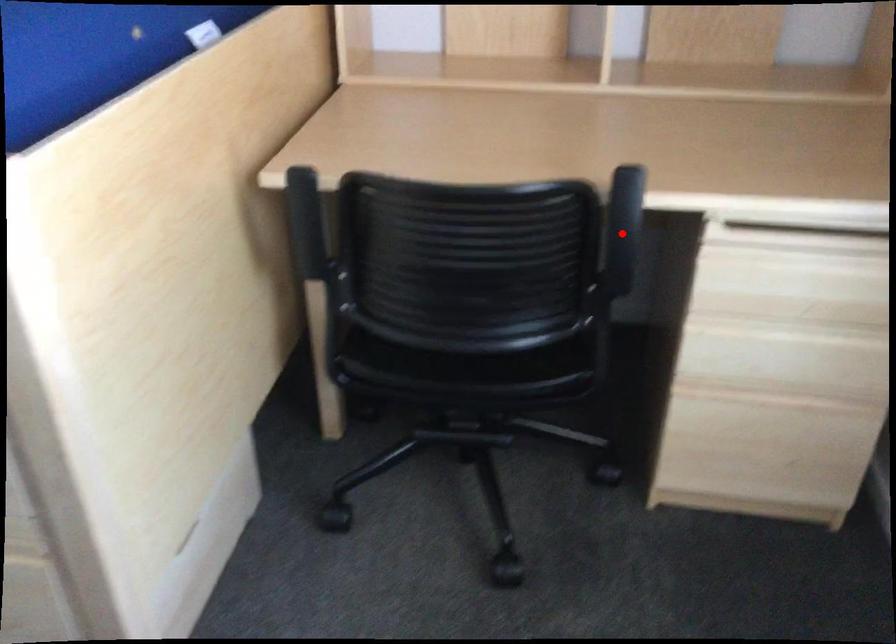
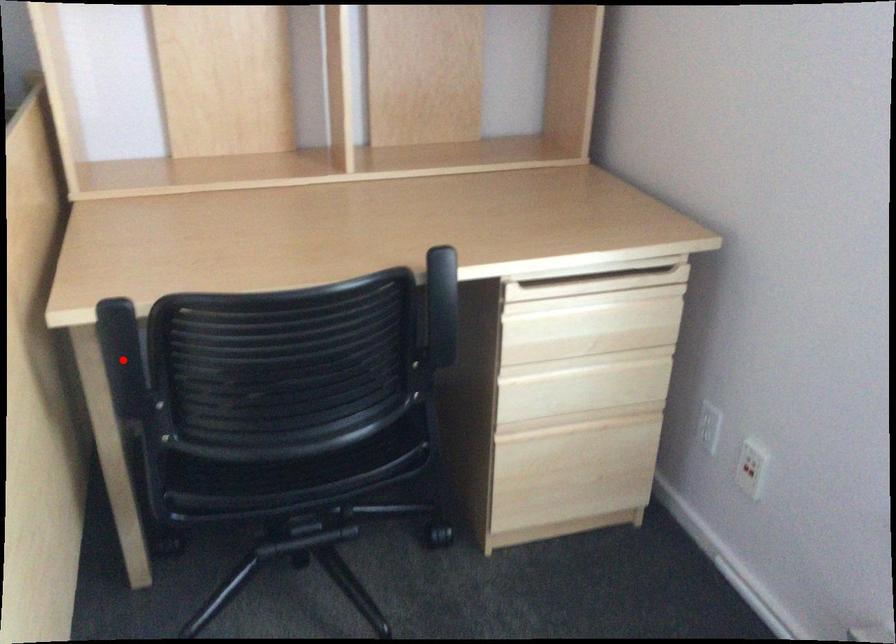
I am providing you with two images of the same scene from different viewpoints. A red point is marked on the first image and another point is marked on the second image. Does the point marked in image1 correspond to the same location as the one in image2?

No